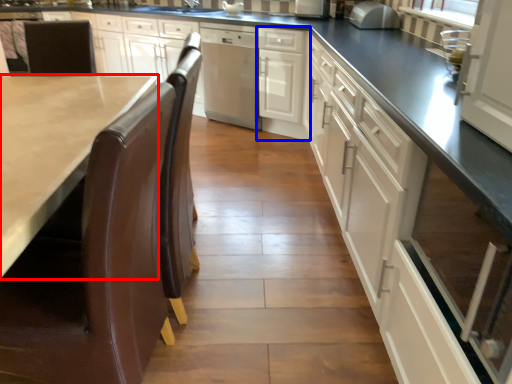
Question: Which of the following is the closest to the observer, countertop (highlighted by a red box) or cabinetry (highlighted by a blue box)?

Choices:
 (A) countertop
 (B) cabinetry

Answer: (A)